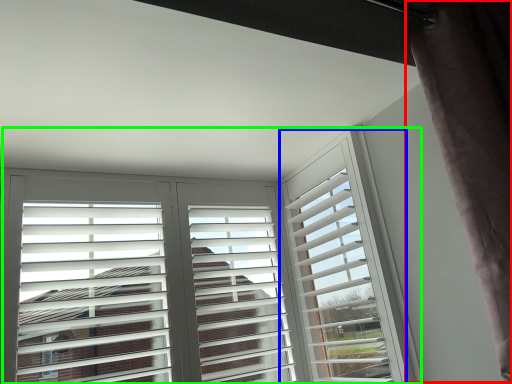
Question: Estimate the real-world distances between objects in this image. Which object is closer to curtain (highlighted by a red box), window frame (highlighted by a blue box) or window (highlighted by a green box)?

Choices:
 (A) window frame
 (B) window

Answer: (A)